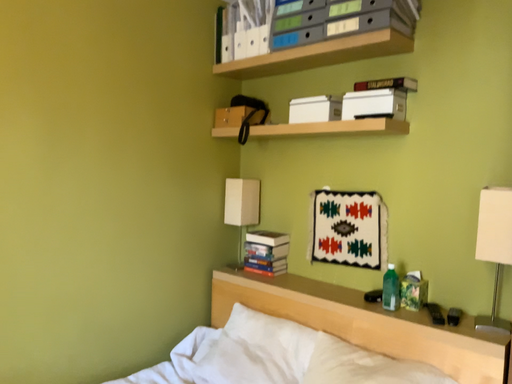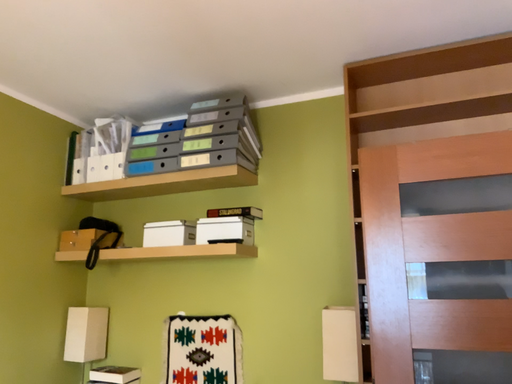
Question: How did the camera likely rotate when shooting the video?

Choices:
 (A) rotated downward
 (B) rotated upward

Answer: (B)